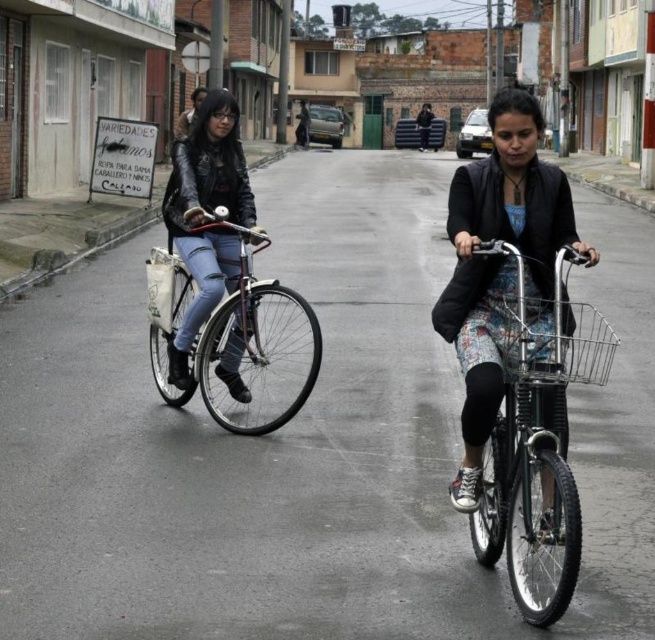
Question: Estimate the real-world distances between objects in this image. Which object is closer to the leather jacket at center?

Choices:
 (A) metallic wire basket at center
 (B) shiny metallic bicycle at center

Answer: (B)

Question: Can you confirm if floral dress at center is smaller than metallic silver bicycle at center?

Choices:
 (A) yes
 (B) no

Answer: (B)

Question: Is shiny metallic bicycle at center to the left of leather jacket at center from the viewer's perspective?

Choices:
 (A) yes
 (B) no

Answer: (B)

Question: Which object appears closest to the camera in this image?

Choices:
 (A) floral dress at center
 (B) leather jacket at center
 (C) shiny metallic bicycle at center
 (D) metallic wire basket at center

Answer: (A)

Question: Which of the following is the closest to the observer?

Choices:
 (A) (231, 314)
 (B) (552, 502)
 (C) (474, 276)
 (D) (210, 234)

Answer: (B)

Question: From the image, what is the correct spatial relationship of floral dress at center in relation to shiny metallic bicycle at center?

Choices:
 (A) left
 (B) right

Answer: (B)